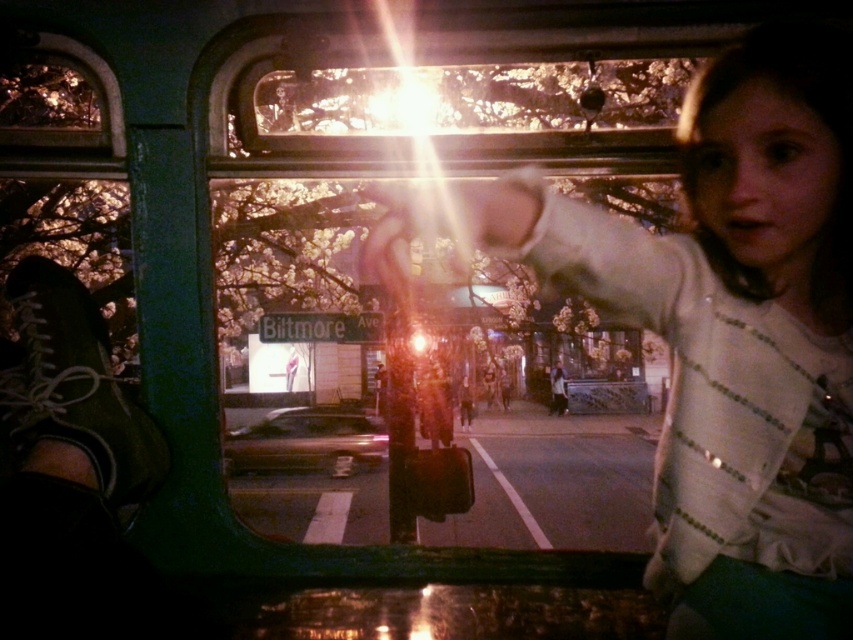
Question: Can you confirm if matte white shirt at center is smaller than smooth leather jacket at center?

Choices:
 (A) yes
 (B) no

Answer: (B)

Question: Which of the following is the closest to the observer?

Choices:
 (A) (467, 380)
 (B) (795, 438)
 (C) (563, 403)
 (D) (279, 432)

Answer: (B)

Question: Is matte white shirt at center below smooth leather jacket at center?

Choices:
 (A) no
 (B) yes

Answer: (A)

Question: Can you confirm if shiny metallic car at center is bigger than smooth leather jacket at center?

Choices:
 (A) yes
 (B) no

Answer: (A)

Question: Which object is farther from the camera taking this photo?

Choices:
 (A) smooth leather jacket at center
 (B) white cotton shirt at center
 (C) shiny metallic car at center

Answer: (B)

Question: Which point appears farthest from the camera in this image?

Choices:
 (A) (682, 536)
 (B) (550, 404)
 (C) (469, 404)

Answer: (B)